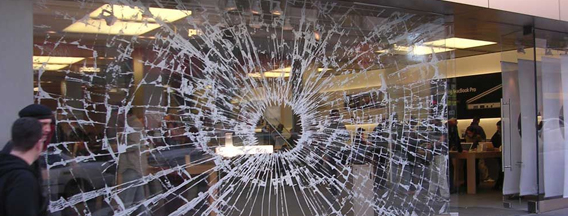
This screenshot has height=216, width=568. Identify the location of door handle. (509, 119).